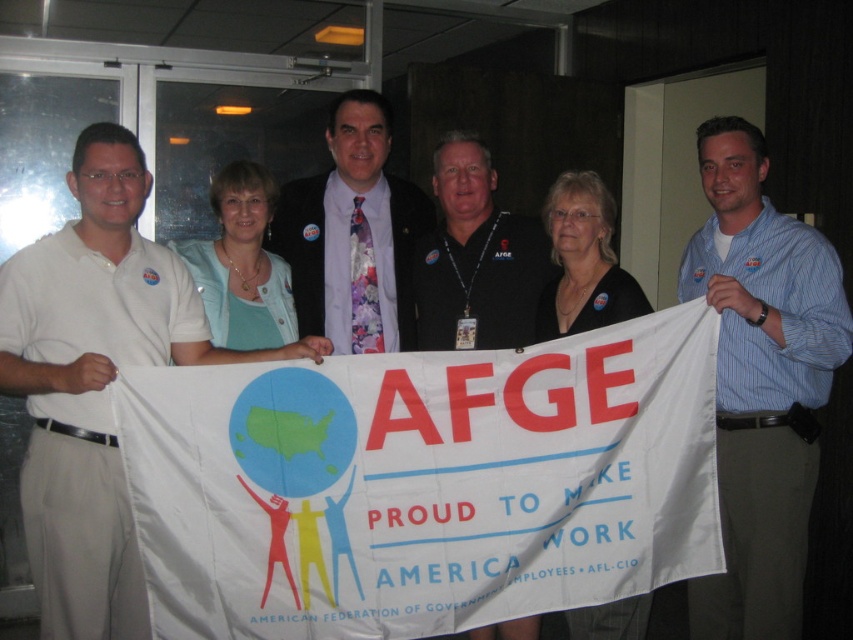
Is white shirt at left bigger than blue striped shirt at center?

Correct, white shirt at left is larger in size than blue striped shirt at center.

Does white shirt at left have a lesser width compared to blue striped shirt at center?

Incorrect, white shirt at left's width is not less than blue striped shirt at center's.

Identify the location of white shirt at left. Image resolution: width=853 pixels, height=640 pixels. (96, 381).

Is white fabric banner at center to the left of white shirt at left from the viewer's perspective?

No, white fabric banner at center is not to the left of white shirt at left.

Does white fabric banner at center have a lesser height compared to white shirt at left?

Correct, white fabric banner at center is not as tall as white shirt at left.

Where is `white fabric banner at center`? Image resolution: width=853 pixels, height=640 pixels. white fabric banner at center is located at coordinates click(x=422, y=483).

The width and height of the screenshot is (853, 640). I want to click on white fabric banner at center, so click(x=422, y=483).

Is white fabric banner at center below black shirt at center?

Yes, white fabric banner at center is below black shirt at center.

Is white fabric banner at center shorter than black shirt at center?

No.

Between point (335, 608) and point (488, 292), which one is positioned in front?

Point (335, 608) is in front.

Locate an element on the screen. This screenshot has width=853, height=640. white fabric banner at center is located at coordinates (422, 483).